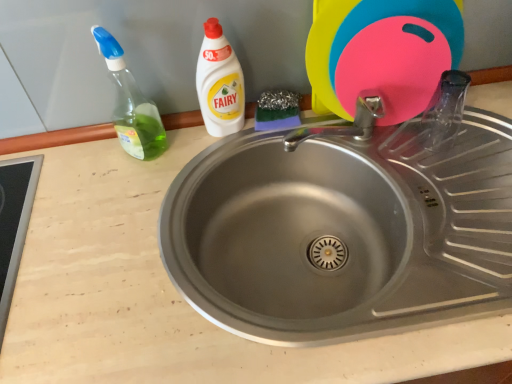
This screenshot has height=384, width=512. Identify the location of free space to the left of white plastic bottle at upper center. (155, 160).